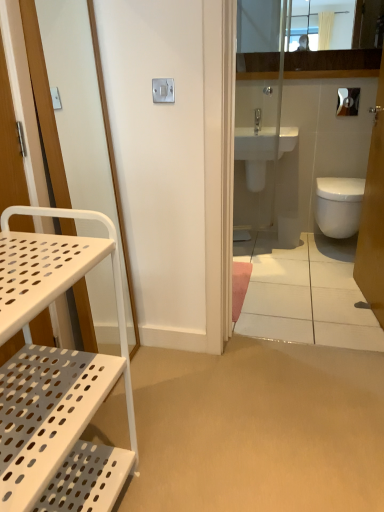
Question: Is white glossy bidet at right, the second bidet viewed from the left, surrounding white perforated shelf at left, the second screen door when ordered from right to left?

Choices:
 (A) no
 (B) yes

Answer: (A)

Question: From a real-world perspective, is white glossy bidet at right, which is the 1th bidet in right-to-left order, on top of white perforated shelf at left, the second screen door when ordered from right to left?

Choices:
 (A) no
 (B) yes

Answer: (A)

Question: From the image's perspective, is white glossy bidet at right, which is the 1th bidet in right-to-left order, under white perforated shelf at left, which is the first screen door from left to right?

Choices:
 (A) no
 (B) yes

Answer: (A)

Question: Considering the relative positions of white glossy bidet at right, which is the 1th bidet in right-to-left order, and white perforated shelf at left, which is the first screen door from left to right, in the image provided, is white glossy bidet at right, which is the 1th bidet in right-to-left order, to the left of white perforated shelf at left, which is the first screen door from left to right, from the viewer's perspective?

Choices:
 (A) yes
 (B) no

Answer: (B)

Question: Is white glossy bidet at right, which is the 1th bidet in right-to-left order, shorter than white perforated shelf at left, which is the first screen door from left to right?

Choices:
 (A) yes
 (B) no

Answer: (A)

Question: Does white glossy bidet at right, the second bidet viewed from the left, have a lesser width compared to white perforated shelf at left, the second screen door when ordered from right to left?

Choices:
 (A) yes
 (B) no

Answer: (B)

Question: Is white glossy toilet at right bigger than white perforated metal cart at left?

Choices:
 (A) yes
 (B) no

Answer: (A)

Question: Is white glossy toilet at right touching white perforated metal cart at left?

Choices:
 (A) no
 (B) yes

Answer: (A)

Question: Is white glossy toilet at right to the right of white perforated metal cart at left from the viewer's perspective?

Choices:
 (A) no
 (B) yes

Answer: (B)

Question: From the image's perspective, would you say white glossy toilet at right is shown under white perforated metal cart at left?

Choices:
 (A) no
 (B) yes

Answer: (A)

Question: Is white glossy toilet at right closer to the viewer compared to white perforated metal cart at left?

Choices:
 (A) yes
 (B) no

Answer: (B)

Question: Is white glossy toilet at right aimed at white perforated metal cart at left?

Choices:
 (A) no
 (B) yes

Answer: (A)

Question: From the image's perspective, would you say white perforated metal cart at left is positioned over white glossy screen door at upper right, arranged as the 2th screen door when viewed from the left?

Choices:
 (A) no
 (B) yes

Answer: (A)